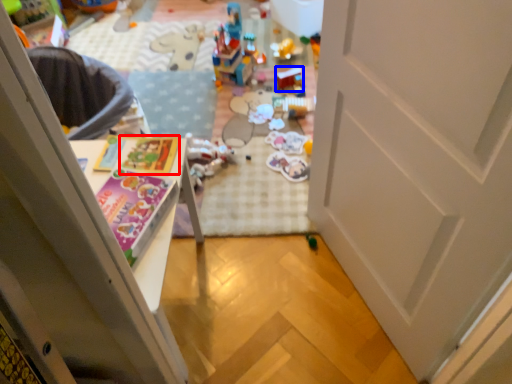
Question: Which of the following is the closest to the observer, magazine (highlighted by a red box) or toy (highlighted by a blue box)?

Choices:
 (A) magazine
 (B) toy

Answer: (A)